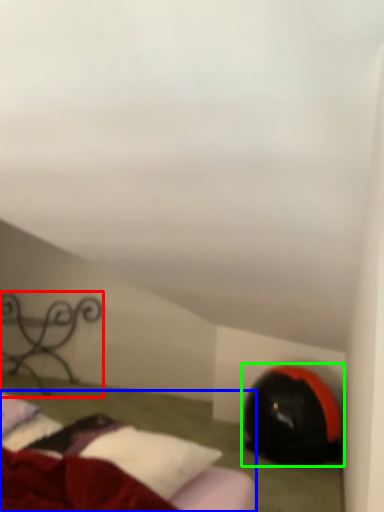
Question: Which is farther away from furniture (highlighted by a red box)? bed (highlighted by a blue box) or bean bag chair (highlighted by a green box)?

Choices:
 (A) bed
 (B) bean bag chair

Answer: (A)